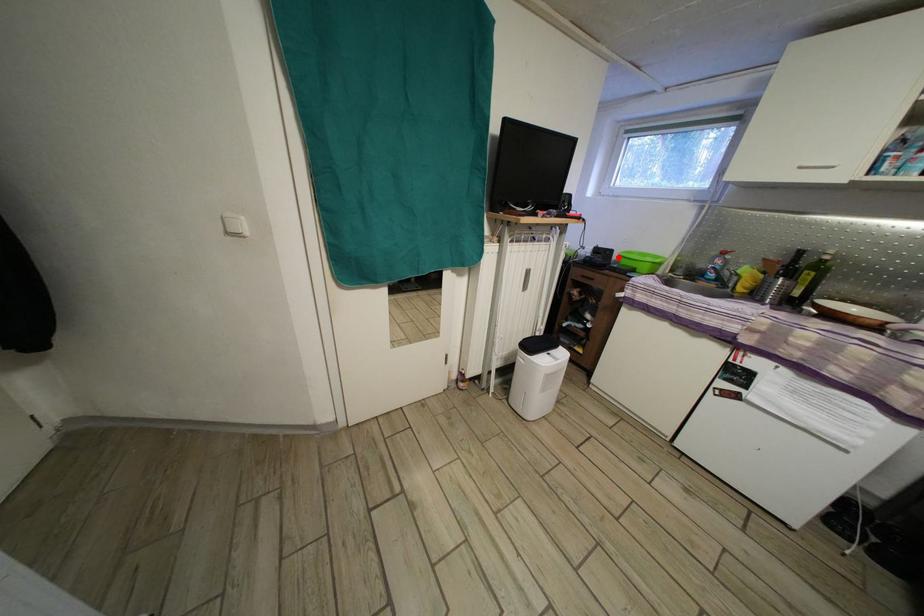
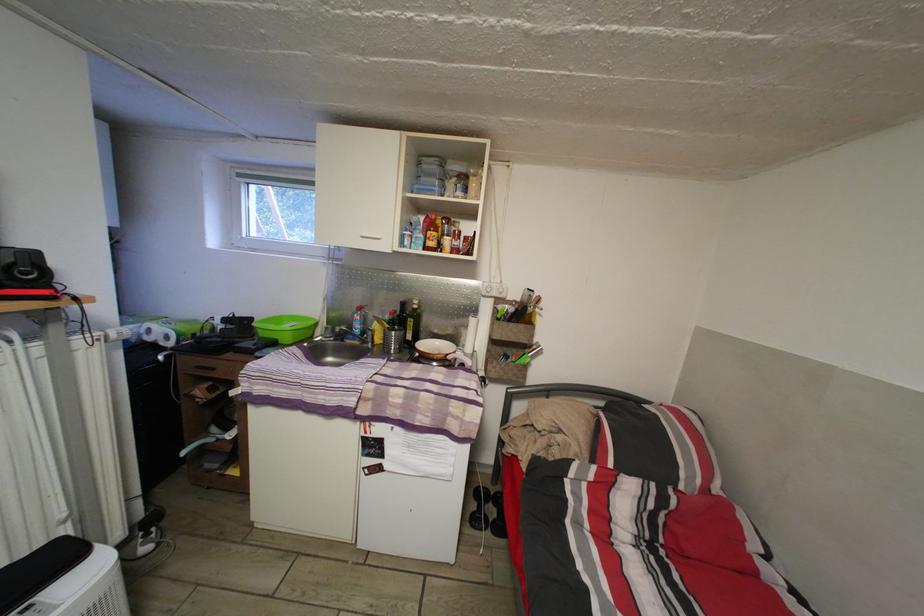
Where in the second image is the point corresponding to the highlighted location from the first image?

(257, 326)